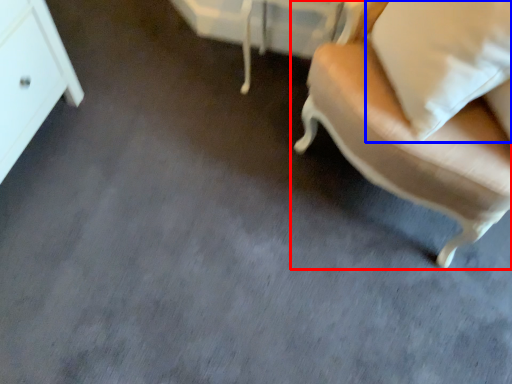
Question: Which of the following is the closest to the observer, chair (highlighted by a red box) or pillow (highlighted by a blue box)?

Choices:
 (A) chair
 (B) pillow

Answer: (A)